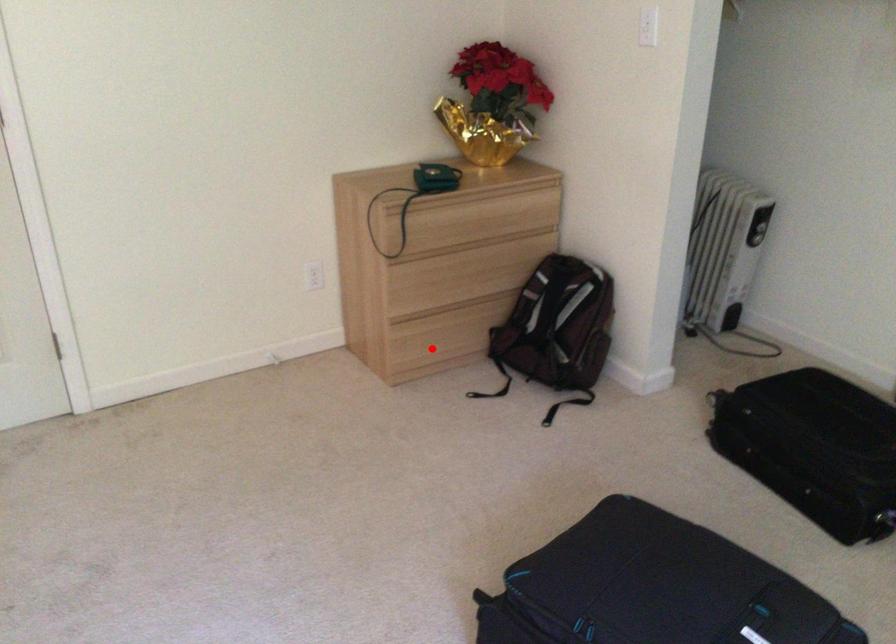
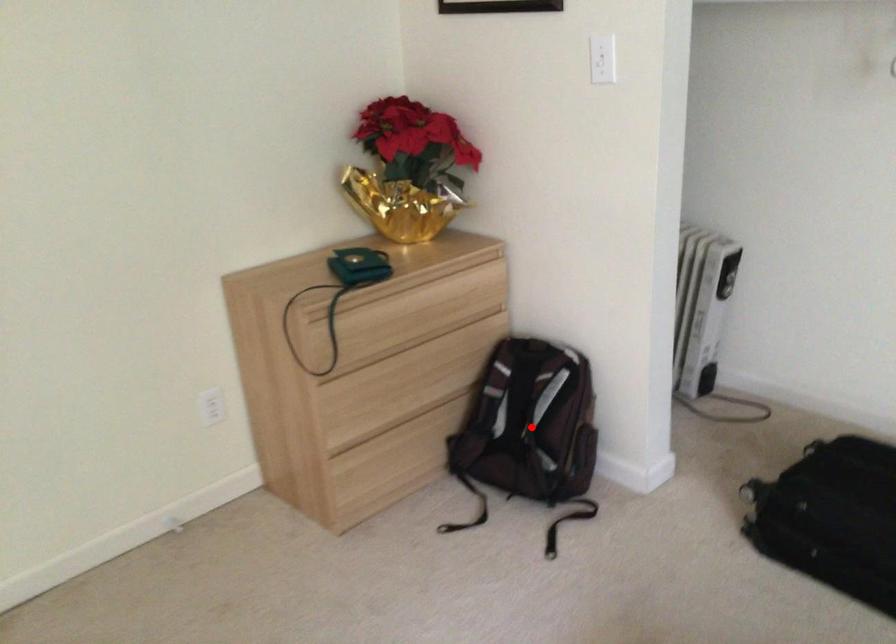
I am providing you with two images of the same scene from different viewpoints. A red point is marked on the first image and another point is marked on the second image. Does the point marked in image1 correspond to the same location as the one in image2?

No